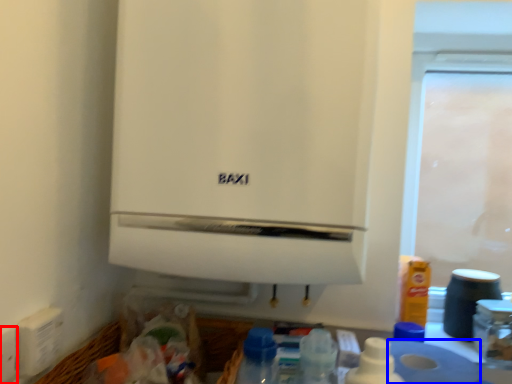
Question: Which point is closer to the camera, electric outlet (highlighted by a red box) or toilet paper (highlighted by a blue box)?

Choices:
 (A) electric outlet
 (B) toilet paper

Answer: (A)